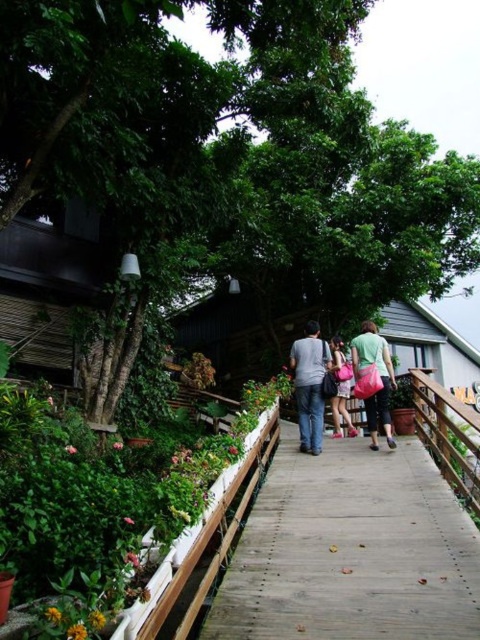
Question: Which point is farther to the camera?

Choices:
 (A) matte green shirt at center
 (B) pink fabric bag at center
 (C) denim jeans at center

Answer: (B)

Question: Which point is closer to the camera?

Choices:
 (A) (336, 412)
 (B) (388, 353)

Answer: (B)

Question: From the image, what is the correct spatial relationship of wooden walkway at center in relation to denim jeans at center?

Choices:
 (A) left
 (B) right

Answer: (B)

Question: From the image, what is the correct spatial relationship of matte green shirt at center in relation to pink fabric bag at center?

Choices:
 (A) right
 (B) left

Answer: (A)

Question: Does denim jeans at center have a greater width compared to matte green shirt at center?

Choices:
 (A) yes
 (B) no

Answer: (B)

Question: Which point is closer to the camera?

Choices:
 (A) pink fabric bag at center
 (B) wooden walkway at center
 (C) matte green shirt at center

Answer: (B)